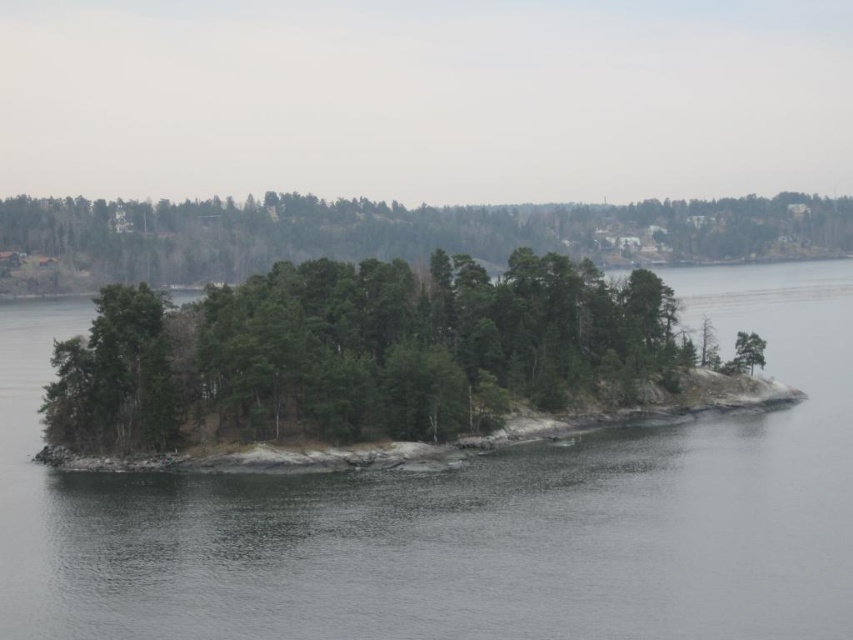
You are a drone operator trying to navigate between two points marked on the forested island. The first point is at coordinate point [91,273] and the second is at point [54,426]. Which point should you aim for first if you want to reach the closer one to your current position?

Point [54,426] is closer to your current position because point [91,273] is further to the camera than point [54,426].

You are a bird soaring above the scene. You want to land on the green textured island at center. Considering the gray water at center, which is higher, would you need to fly upwards or downwards to reach the island?

The gray water at center has a greater height compared to the green textured island at center. To land on the green textured island at center, you would need to fly downwards since the island is lower in elevation than the water.